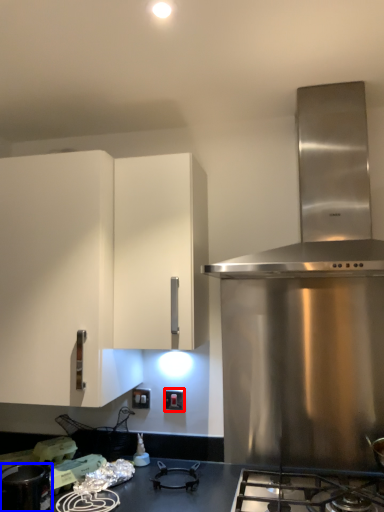
Question: Which of the following is the closest to the observer, electric outlet (highlighted by a red box) or kitchen appliance (highlighted by a blue box)?

Choices:
 (A) electric outlet
 (B) kitchen appliance

Answer: (B)